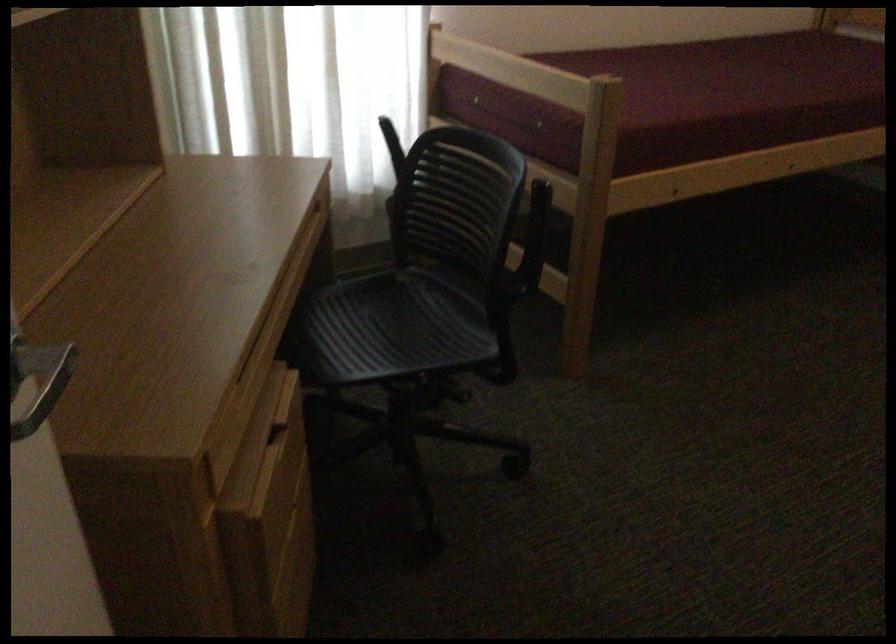
Where would you turn the silver door handle? Please return your answer as a coordinate pair (x, y).

(55, 380)